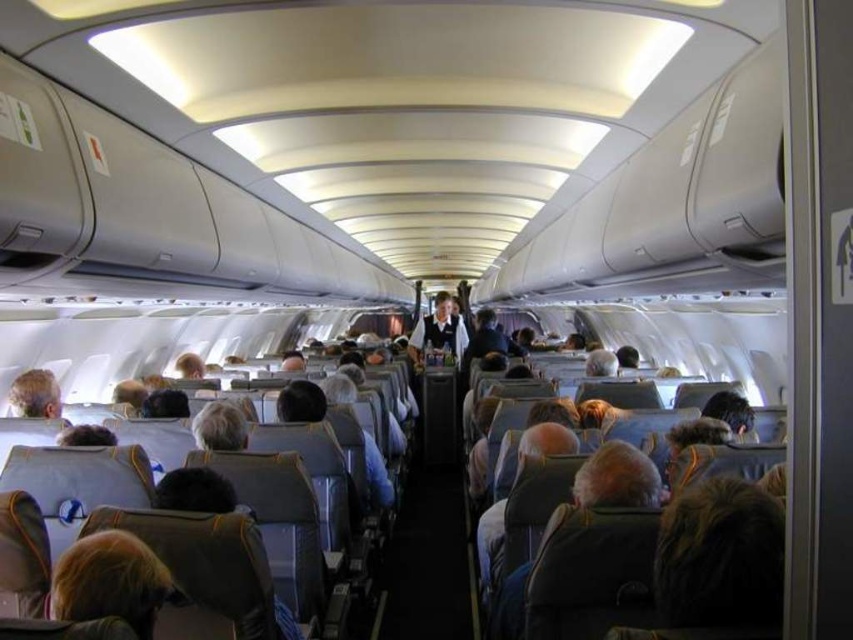
Question: Does blonde hair at lower left come behind light brown leather headrest at lower left?

Choices:
 (A) no
 (B) yes

Answer: (A)

Question: In this image, where is blonde hair at lower left located relative to light brown leather headrest at lower left?

Choices:
 (A) above
 (B) below

Answer: (B)

Question: Which point is closer to the camera taking this photo?

Choices:
 (A) (53, 604)
 (B) (15, 403)

Answer: (A)

Question: Can you confirm if blonde hair at lower left is smaller than light brown leather headrest at lower left?

Choices:
 (A) no
 (B) yes

Answer: (B)

Question: Which object appears closest to the camera in this image?

Choices:
 (A) blonde hair at lower left
 (B) light brown leather headrest at lower left

Answer: (A)

Question: Which point is closer to the camera?

Choices:
 (A) (117, 609)
 (B) (27, 388)

Answer: (A)